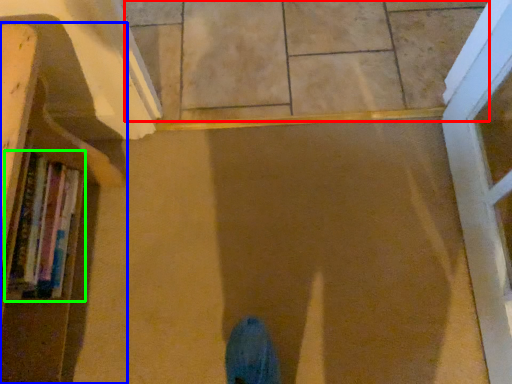
Question: Which is farther away from tile (highlighted by a red box)? bookcase (highlighted by a blue box) or book (highlighted by a green box)?

Choices:
 (A) bookcase
 (B) book

Answer: (B)